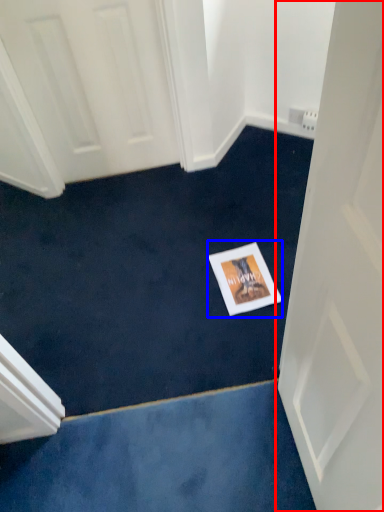
Question: Which point is closer to the camera, door (highlighted by a red box) or postcard (highlighted by a blue box)?

Choices:
 (A) door
 (B) postcard

Answer: (A)